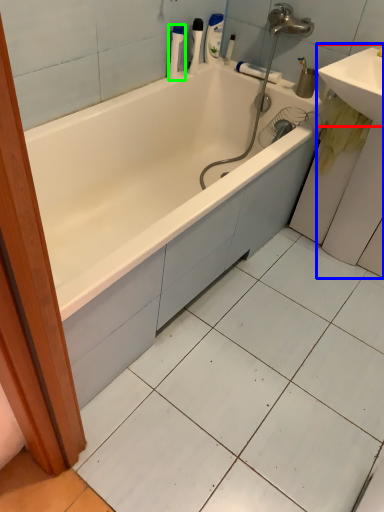
Question: Which object is positioned closest to sink (highlighted by a red box)? Select from sink (highlighted by a blue box) and cleaning product (highlighted by a green box).

Choices:
 (A) sink
 (B) cleaning product

Answer: (A)